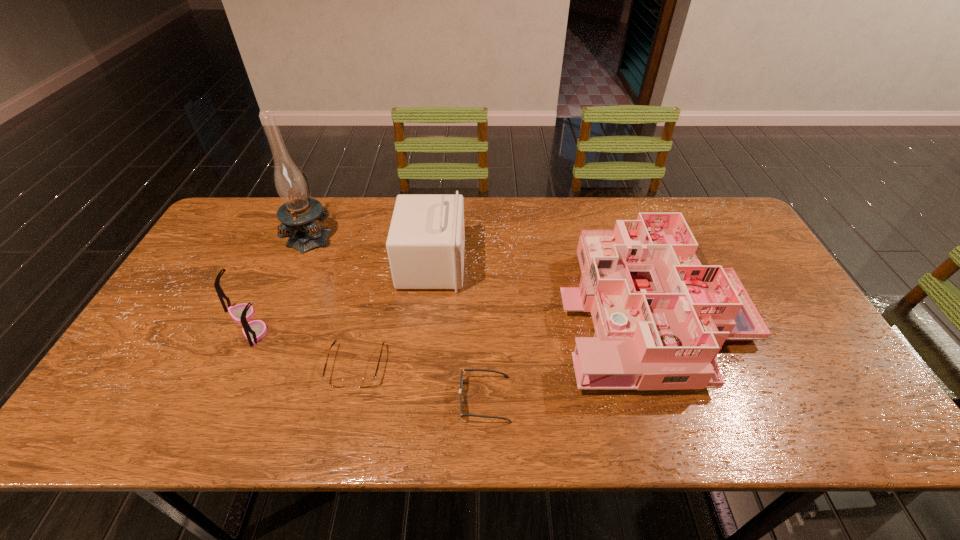
This screenshot has width=960, height=540. I want to click on the tallest object, so click(x=298, y=214).

What are the coordinates of `the fifth shortest object` in the screenshot? It's located at (425, 245).

Where is `the rightmost object`? the rightmost object is located at coordinates (660, 317).

Identify the location of the leftmost spectacles. tap(255, 330).

The image size is (960, 540). Identify the location of the fifth object from left to right. (462, 370).

The image size is (960, 540). In order to click on the second spectacles from left to right in this screenshot , I will do 363,382.

Find the location of a particular element. Image resolution: width=960 pixels, height=540 pixels. vacant point located 0.090m on the front of the tallest object is located at coordinates (294, 275).

You are a GUI agent. You are given a task and a screenshot of the screen. Output one action in this format:
    pyautogui.click(x=<x>, y=<y>)
    Task: Click on the vacant space located on the front-facing side of the fifth shortest object
    The image size is (960, 540).
    Given the screenshot: What is the action you would take?
    pyautogui.click(x=484, y=265)

Find the location of a particular element. Image resolution: width=960 pixels, height=540 pixels. vacant space situated at the front entrance of the rightmost object is located at coordinates (481, 308).

Where is `free location located 0.200m at the front entrance of the rightmost object`? Image resolution: width=960 pixels, height=540 pixels. free location located 0.200m at the front entrance of the rightmost object is located at coordinates coord(488,308).